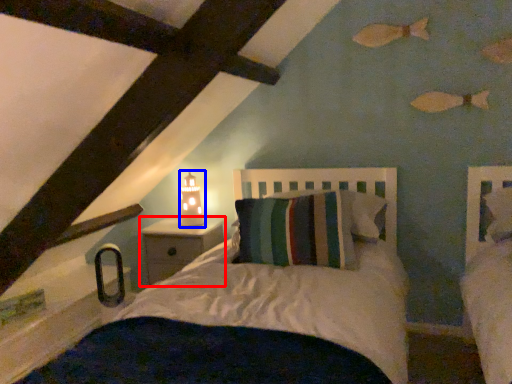
Question: Which object appears closest to the camera in this image, nightstand (highlighted by a red box) or table lamp (highlighted by a blue box)?

Choices:
 (A) nightstand
 (B) table lamp

Answer: (A)